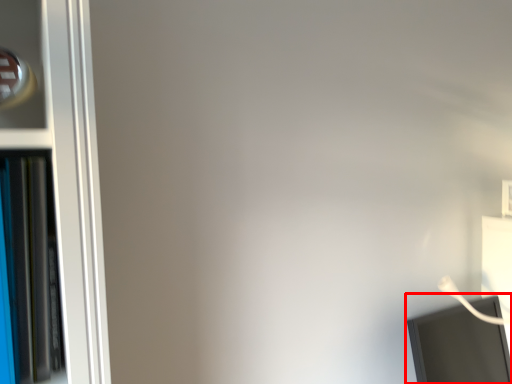
Question: Observing the image, what is the correct spatial positioning of computer monitor (annotated by the red box) in reference to bookcase?

Choices:
 (A) right
 (B) left

Answer: (A)